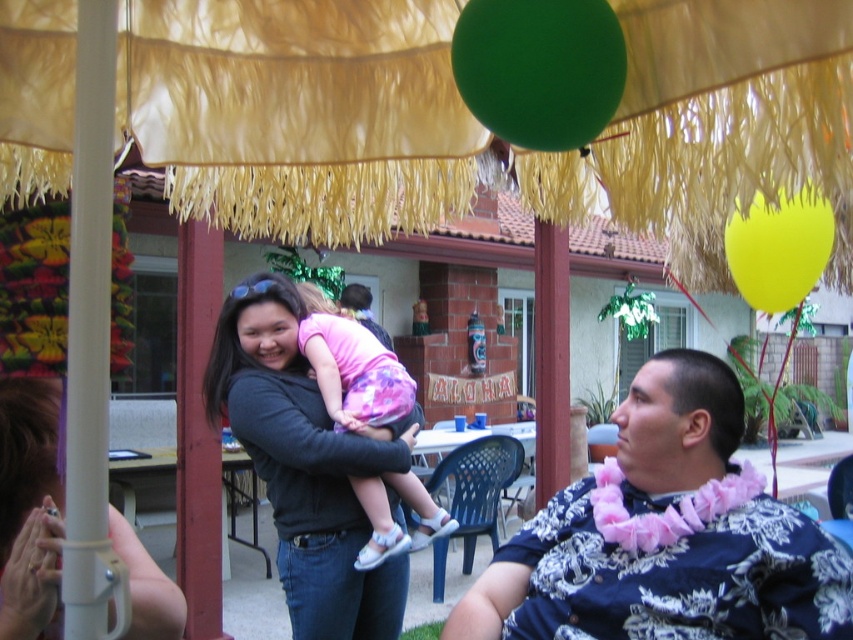
You are at a festive event under a thatched roof and see the green matte balloon at upper center and the yellow rubber balloon at upper right. Which balloon is smaller?

The green matte balloon at upper center is smaller than the yellow rubber balloon at upper right.

You are standing at the thatched roof structure and want to take a photo. There are two points in the scene labeled as point (503, 77) and point (819, 273). Which point should you focus on first if you want to capture the closest object in your shot?

Point (503, 77) is closer to the camera than point (819, 273), so you should focus on point (503, 77) first to capture the closest object in your shot.